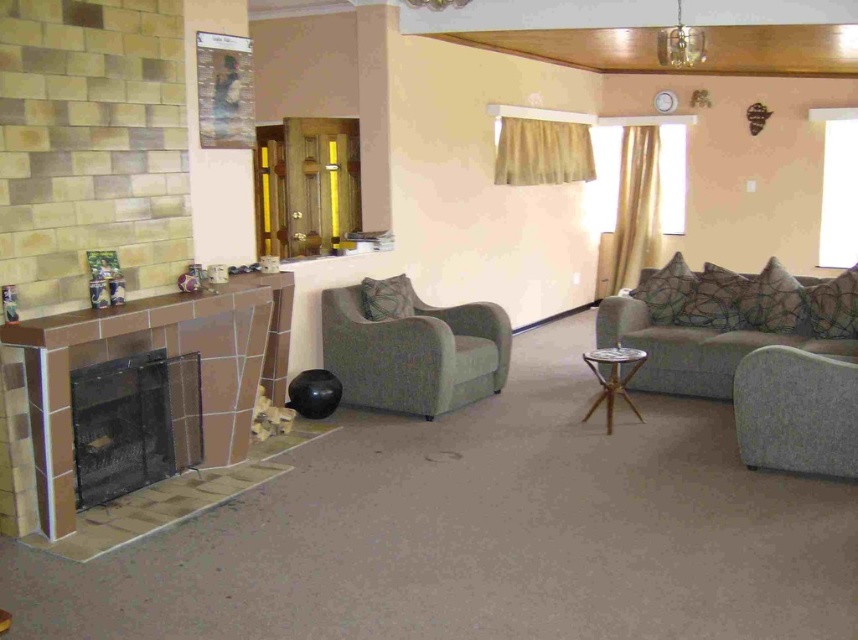
Can you confirm if textured gray couch at right is taller than wooden tripod table at center?

Correct, textured gray couch at right is much taller as wooden tripod table at center.

Does textured gray couch at right appear under wooden tripod table at center?

No, textured gray couch at right is not below wooden tripod table at center.

Who is more forward, (651, 284) or (615, 392)?

Point (615, 392)

The width and height of the screenshot is (858, 640). Identify the location of textured gray couch at right. (724, 321).

This screenshot has height=640, width=858. In order to click on brown tile fireplace at left in this screenshot , I will do `click(149, 349)`.

Which is above, brown tile fireplace at left or wooden tripod table at center?

Positioned higher is brown tile fireplace at left.

Identify the location of brown tile fireplace at left. The width and height of the screenshot is (858, 640). (149, 349).

Is brown tile fireplace at left in front of matte green fabric armchair at center?

Yes.

How far apart are brown tile fireplace at left and matte green fabric armchair at center?

1.13 meters

Find the location of a particular element. brown tile fireplace at left is located at coordinates (149, 349).